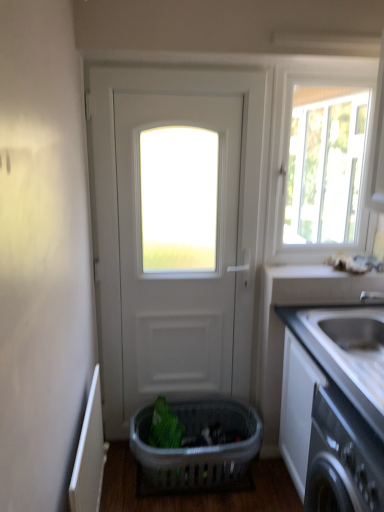
Image resolution: width=384 pixels, height=512 pixels. What do you see at coordinates (173, 272) in the screenshot?
I see `white matte door at center` at bounding box center [173, 272].

What do you see at coordinates (317, 167) in the screenshot? I see `white glossy window at upper right` at bounding box center [317, 167].

Measure the distance between white glossy countertop at right and camera.

3.59 feet.

Find the location of a particular element. white matte door at center is located at coordinates (173, 272).

What's the angular difference between white matte door at center and plastic basket at center's facing directions?

The angle between the facing direction of white matte door at center and the facing direction of plastic basket at center is 0.463 degrees.

From the image's perspective, is white matte door at center on top of plastic basket at center?

Correct, white matte door at center appears higher than plastic basket at center in the image.

Is white matte door at center not within plastic basket at center?

Yes.

Can you confirm if white matte door at center is thinner than plastic basket at center?

Indeed, white matte door at center has a lesser width compared to plastic basket at center.

Does plastic basket at center have a greater height compared to white glossy window at upper right?

No, plastic basket at center is not taller than white glossy window at upper right.

Can you confirm if plastic basket at center is wider than white glossy window at upper right?

Correct, the width of plastic basket at center exceeds that of white glossy window at upper right.

From the picture: Are plastic basket at center and white glossy window at upper right located far from each other?

Yes, plastic basket at center and white glossy window at upper right are quite far apart.

Considering the relative positions of plastic basket at center and white glossy window at upper right in the image provided, is plastic basket at center to the left or to the right of white glossy window at upper right?

plastic basket at center is to the left of white glossy window at upper right.

What are the coordinates of `door located in front of the white glossy window at upper right` in the screenshot? It's located at (173, 272).

Are white matte door at center and white glossy window at upper right far apart?

Yes, white matte door at center is far from white glossy window at upper right.

Does white matte door at center lie behind white glossy window at upper right?

No.

Is white glossy window at upper right at the back of white matte door at center?

No, white matte door at center is not facing away from white glossy window at upper right.

Is plastic basket at center looking in the opposite direction of white glossy countertop at right?

plastic basket at center does not have its back to white glossy countertop at right.

Between plastic basket at center and white glossy countertop at right, which one is positioned behind?

plastic basket at center.

Between plastic basket at center and white glossy countertop at right, which one has smaller width?

Thinner between the two is plastic basket at center.

Would you say plastic basket at center is outside white glossy countertop at right?

Yes, plastic basket at center is located beyond the bounds of white glossy countertop at right.

Does plastic basket at center come in front of white matte door at center?

No, it is behind white matte door at center.

From the image's perspective, is plastic basket at center below white matte door at center?

Yes, from the image's perspective, plastic basket at center is beneath white matte door at center.

Which is correct: plastic basket at center is inside white matte door at center, or outside of it?

plastic basket at center cannot be found inside white matte door at center.

From a real-world perspective, who is located higher, plastic basket at center or white matte door at center?

white matte door at center is physically above.

Does point (296, 396) come farther from viewer compared to point (202, 87)?

No, it is in front of (202, 87).

From a real-world perspective, is white glossy countertop at right located higher than white matte door at center?

No, from a real-world perspective, white glossy countertop at right is not above white matte door at center.

Is the position of white glossy countertop at right more distant than that of white matte door at center?

That is False.

In the scene shown: Is white glossy countertop at right oriented towards white matte door at center?

No.

Which object is closer to the camera, white glossy window at upper right or white matte door at center?

white matte door at center is more forward.

Where is `window lying behind the white matte door at center`? The width and height of the screenshot is (384, 512). window lying behind the white matte door at center is located at coordinates (317, 167).

Based on the photo, in terms of size, does white glossy window at upper right appear bigger or smaller than white matte door at center?

Clearly, white glossy window at upper right is smaller in size than white matte door at center.

What's the angular difference between white glossy window at upper right and white matte door at center's facing directions?

white glossy window at upper right and white matte door at center are facing 0.37 degrees away from each other.

Where is `basket behind the white matte door at center`? The width and height of the screenshot is (384, 512). basket behind the white matte door at center is located at coordinates (197, 446).

This screenshot has width=384, height=512. What are the coordinates of `basket to the left of white glossy window at upper right` in the screenshot? It's located at (197, 446).

Which object lies further to the anchor point white matte door at center, white glossy countertop at right or white glossy window at upper right?

white glossy window at upper right is further to white matte door at center.

Looking at the image, which one is located closer to white glossy window at upper right, white matte door at center or white glossy countertop at right?

white matte door at center is closer to white glossy window at upper right.

From the image, which object appears to be farther from white matte door at center, plastic basket at center or white glossy countertop at right?

Based on the image, white glossy countertop at right appears to be further to white matte door at center.

When comparing their distances from plastic basket at center, does white matte door at center or white glossy window at upper right seem closer?

The object closer to plastic basket at center is white matte door at center.

From the image, which object appears to be farther from white glossy countertop at right, plastic basket at center or white glossy window at upper right?

Based on the image, white glossy window at upper right appears to be further to white glossy countertop at right.

Which object lies further to the anchor point white glossy window at upper right, white matte door at center or plastic basket at center?

plastic basket at center is further to white glossy window at upper right.

From the image, which object appears to be nearer to white glossy window at upper right, plastic basket at center or white matte door at center?

Based on the image, white matte door at center appears to be nearer to white glossy window at upper right.

Looking at the image, which one is located closer to white glossy countertop at right, white matte door at center or white glossy window at upper right?

Based on the image, white matte door at center appears to be nearer to white glossy countertop at right.

Find the location of a particular element. This screenshot has width=384, height=512. countertop that lies between white matte door at center and plastic basket at center from top to bottom is located at coordinates (334, 406).

Where is `door between white glossy window at upper right and plastic basket at center from top to bottom`? The image size is (384, 512). door between white glossy window at upper right and plastic basket at center from top to bottom is located at coordinates (173, 272).

This screenshot has width=384, height=512. Find the location of `door that lies between white glossy window at upper right and white glossy countertop at right from top to bottom`. door that lies between white glossy window at upper right and white glossy countertop at right from top to bottom is located at coordinates (173, 272).

Locate an element on the screen. The width and height of the screenshot is (384, 512). countertop between white glossy window at upper right and plastic basket at center in the vertical direction is located at coordinates (334, 406).